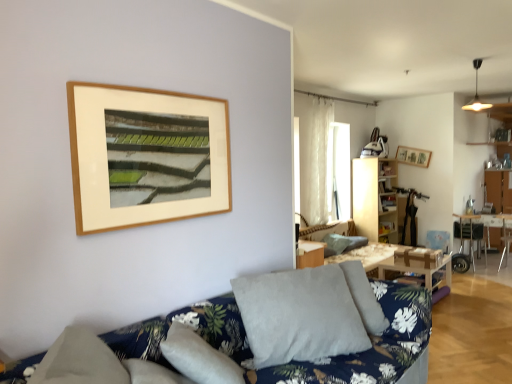
Question: From a real-world perspective, is metallic silver chair at right positioned under wooden table at right, arranged as the 2th table when viewed from the left, based on gravity?

Choices:
 (A) no
 (B) yes

Answer: (A)

Question: Is metallic silver chair at right in front of wooden table at right, arranged as the 2th table when viewed from the left?

Choices:
 (A) no
 (B) yes

Answer: (B)

Question: From a real-world perspective, is metallic silver chair at right on top of wooden table at right, arranged as the 2th table when viewed from the left?

Choices:
 (A) yes
 (B) no

Answer: (A)

Question: Is metallic silver chair at right shorter than wooden table at right, placed as the 1th table when sorted from back to front?

Choices:
 (A) yes
 (B) no

Answer: (B)

Question: Can you confirm if metallic silver chair at right is taller than wooden table at right, placed as the 1th table when sorted from back to front?

Choices:
 (A) no
 (B) yes

Answer: (B)

Question: Is wooden bookshelf at center-right bigger or smaller than gray fabric pillow at center, placed as the second pillow when sorted from right to left?

Choices:
 (A) small
 (B) big

Answer: (B)

Question: Considering the positions of wooden bookshelf at center-right and gray fabric pillow at center, placed as the second pillow when sorted from right to left, in the image, is wooden bookshelf at center-right taller or shorter than gray fabric pillow at center, placed as the second pillow when sorted from right to left,?

Choices:
 (A) short
 (B) tall

Answer: (B)

Question: Is wooden bookshelf at center-right wider or thinner than gray fabric pillow at center, the first pillow viewed from the left?

Choices:
 (A) thin
 (B) wide

Answer: (A)

Question: Is wooden bookshelf at center-right to the left or to the right of gray fabric pillow at center, the first pillow when ordered from front to back, in the image?

Choices:
 (A) right
 (B) left

Answer: (A)

Question: In the image, is wooden table at right, arranged as the first table when viewed from the right, on the left side or the right side of wooden picture frame at upper right?

Choices:
 (A) left
 (B) right

Answer: (B)

Question: Is wooden table at right, the 2th table viewed from the front, wider or thinner than wooden picture frame at upper right?

Choices:
 (A) thin
 (B) wide

Answer: (B)

Question: From a real-world perspective, relative to wooden picture frame at upper right, is wooden table at right, arranged as the 2th table when viewed from the left, vertically above or below?

Choices:
 (A) below
 (B) above

Answer: (A)

Question: Is wooden table at right, arranged as the 2th table when viewed from the left, in front of or behind wooden picture frame at upper right in the image?

Choices:
 (A) front
 (B) behind

Answer: (A)

Question: Considering the positions of point (347, 241) and point (459, 231), is point (347, 241) closer or farther from the camera than point (459, 231)?

Choices:
 (A) closer
 (B) farther

Answer: (A)

Question: In the image, is textured gray pillow at center, which appears as the second pillow when viewed from the front, positioned in front of or behind metallic silver chair at right?

Choices:
 (A) front
 (B) behind

Answer: (A)